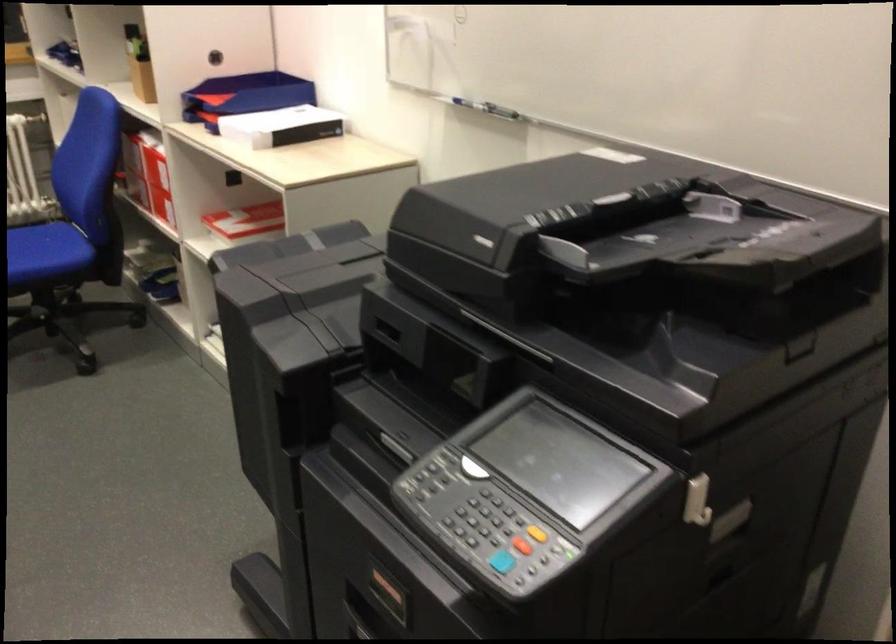
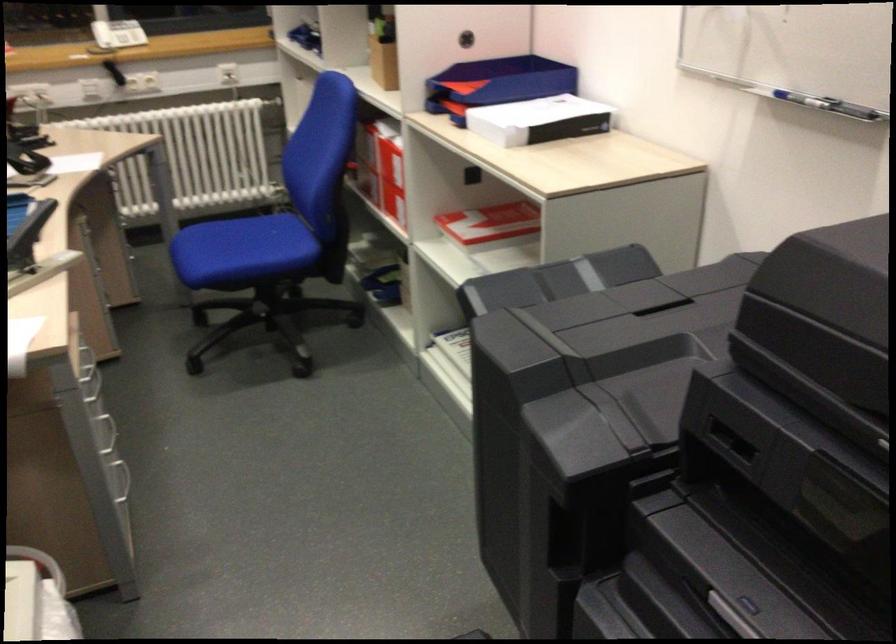
In the second image, find the point that corresponds to (x=481, y=106) in the first image.

(820, 102)